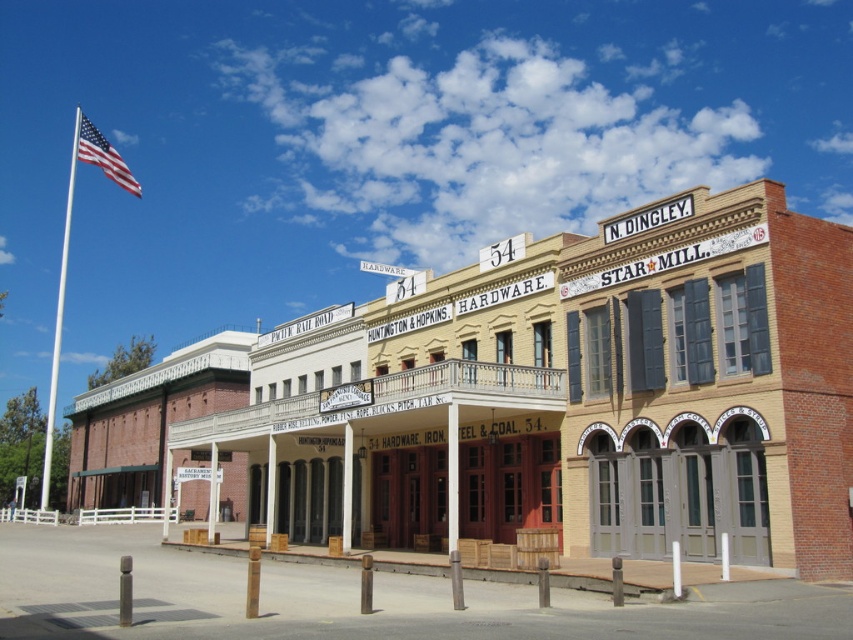
Question: Can you confirm if american flag at upper left is bigger than white wood sign at center?

Choices:
 (A) no
 (B) yes

Answer: (B)

Question: Is white wooden flag pole at left thinner than white wood sign at center?

Choices:
 (A) no
 (B) yes

Answer: (A)

Question: Among these objects, which one is nearest to the camera?

Choices:
 (A) american flag at upper left
 (B) white metallic flag pole at left
 (C) white wooden flag pole at left

Answer: (A)

Question: Which point appears closest to the camera in this image?

Choices:
 (A) (62, 262)
 (B) (83, 154)
 (C) (50, 385)

Answer: (B)

Question: Estimate the real-world distances between objects in this image. Which object is farther from the white wooden flag pole at left?

Choices:
 (A) american flag at upper left
 (B) white wood sign at center
 (C) brick building at center

Answer: (B)

Question: In this image, where is american flag at upper left located relative to white wood sign at center?

Choices:
 (A) below
 (B) above

Answer: (B)